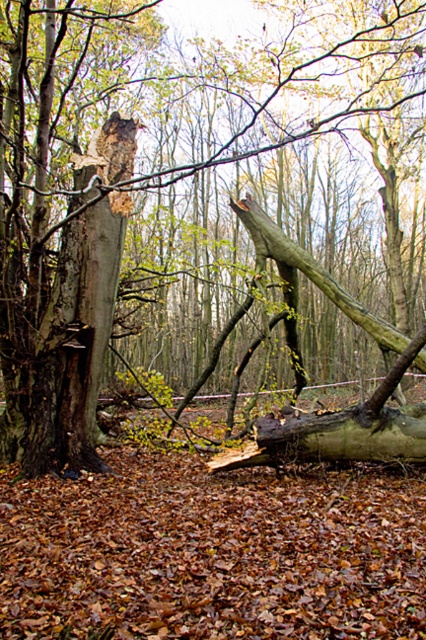
Question: Does smooth bark tree at center come behind smooth brown tree trunk at left?

Choices:
 (A) yes
 (B) no

Answer: (B)

Question: Is smooth bark tree at center below smooth brown tree trunk at left?

Choices:
 (A) no
 (B) yes

Answer: (A)

Question: Can you confirm if smooth bark tree at center is thinner than smooth brown tree trunk at left?

Choices:
 (A) no
 (B) yes

Answer: (A)

Question: Which point is farther to the camera?

Choices:
 (A) smooth bark tree at center
 (B) smooth brown tree trunk at left

Answer: (B)